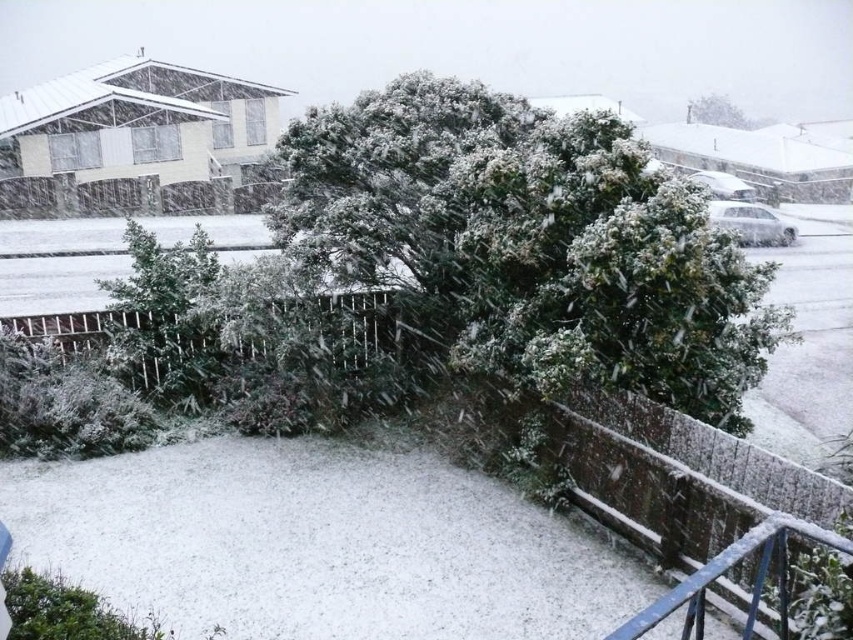
Question: Which point appears closest to the camera in this image?

Choices:
 (A) (457, 275)
 (B) (692, 115)

Answer: (A)

Question: Is green matte bush at center thinner than green leafy bush at upper center?

Choices:
 (A) yes
 (B) no

Answer: (A)

Question: Which point appears farthest from the camera in this image?

Choices:
 (A) (312, 108)
 (B) (699, 109)

Answer: (B)

Question: Among these objects, which one is farthest from the camera?

Choices:
 (A) green leafy bush at upper center
 (B) green matte bush at center

Answer: (A)

Question: Can you confirm if green matte bush at center is positioned above green leafy bush at upper center?

Choices:
 (A) no
 (B) yes

Answer: (A)

Question: Is the position of green matte bush at center more distant than that of green leafy bush at upper center?

Choices:
 (A) yes
 (B) no

Answer: (B)